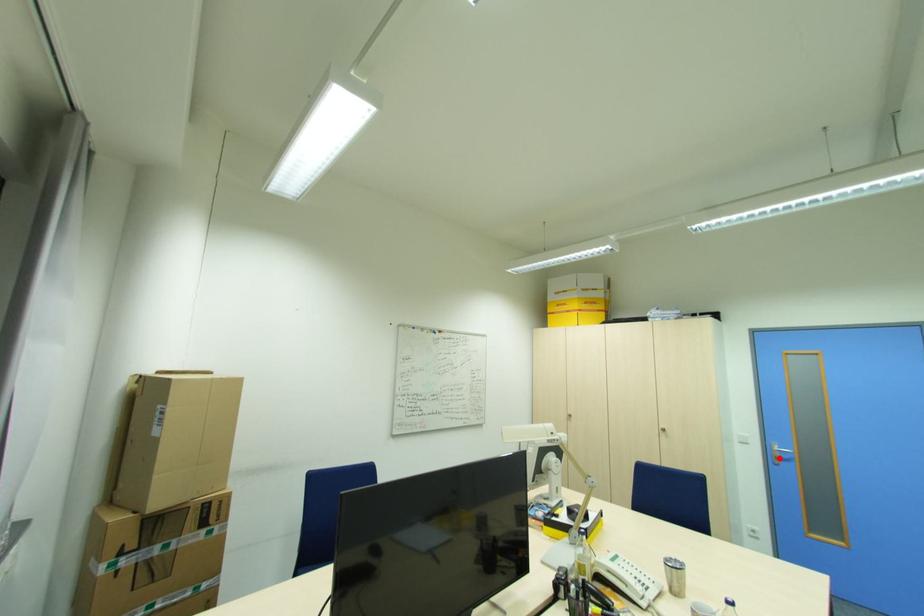
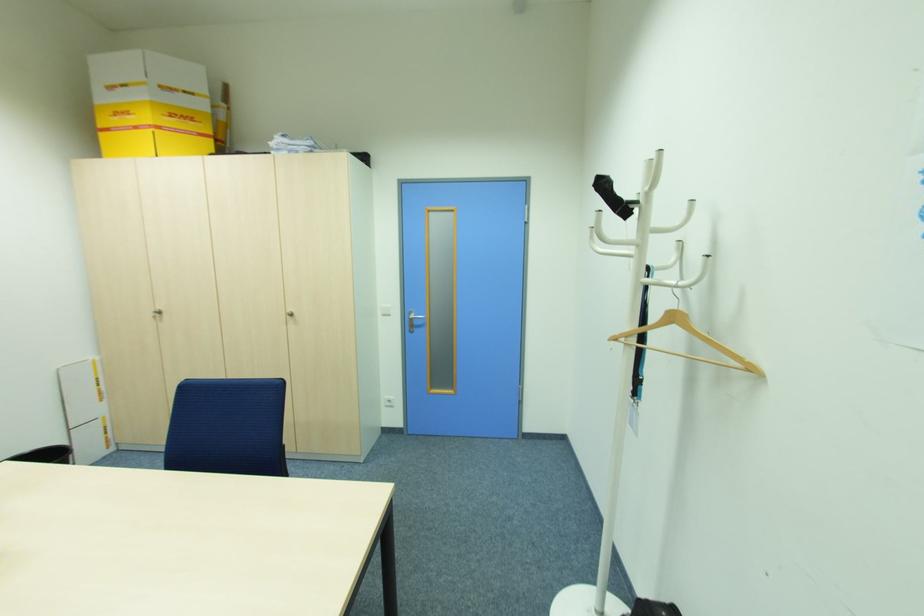
Locate, in the second image, the point that corresponds to the highlighted location in the first image.

(415, 325)